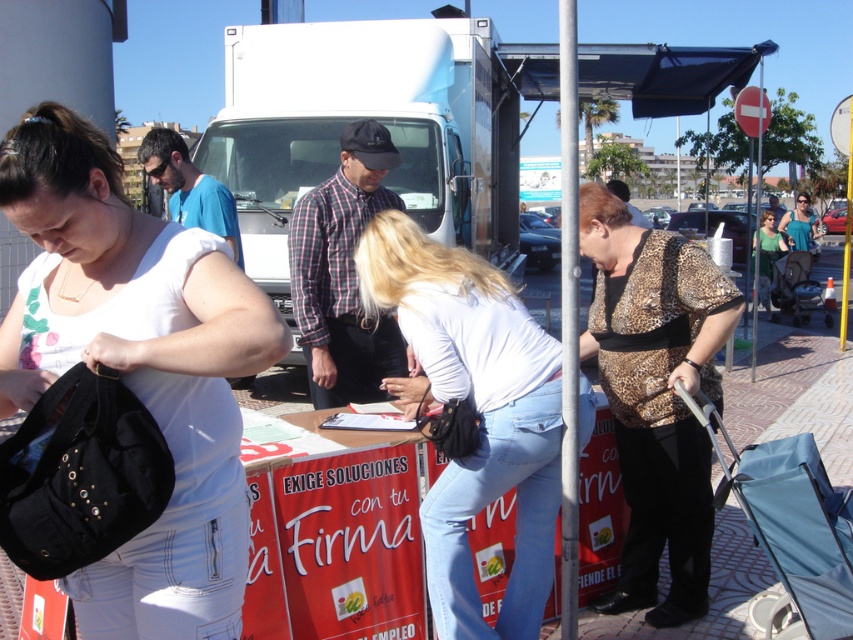
You are standing at the point with coordinates point (440, 333) and want to walk to the point with coordinates point (349, 109). Which direction should you move?

You should move forward because point (349, 109) is behind point (440, 333).

You are a photographer standing at the edge of the scene. You need to capture a photo that includes both the blue fabric stroller at lower right and the green jersey at center. Which object should you adjust your camera angle to focus on first to ensure both are in frame?

You should focus on the blue fabric stroller at lower right first because it is closer to the viewer than the green jersey at center, so adjusting the angle to include it will naturally bring the green jersey into view as well.